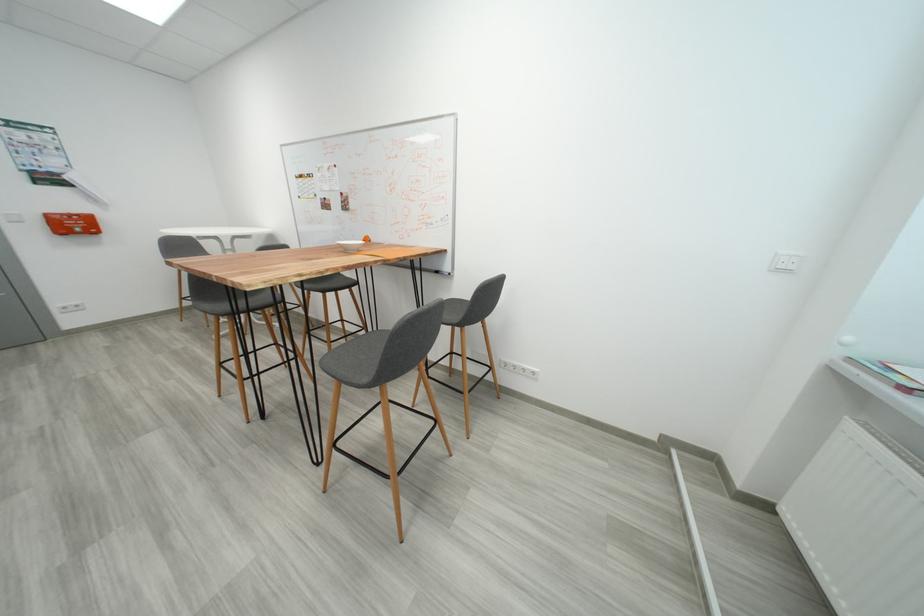
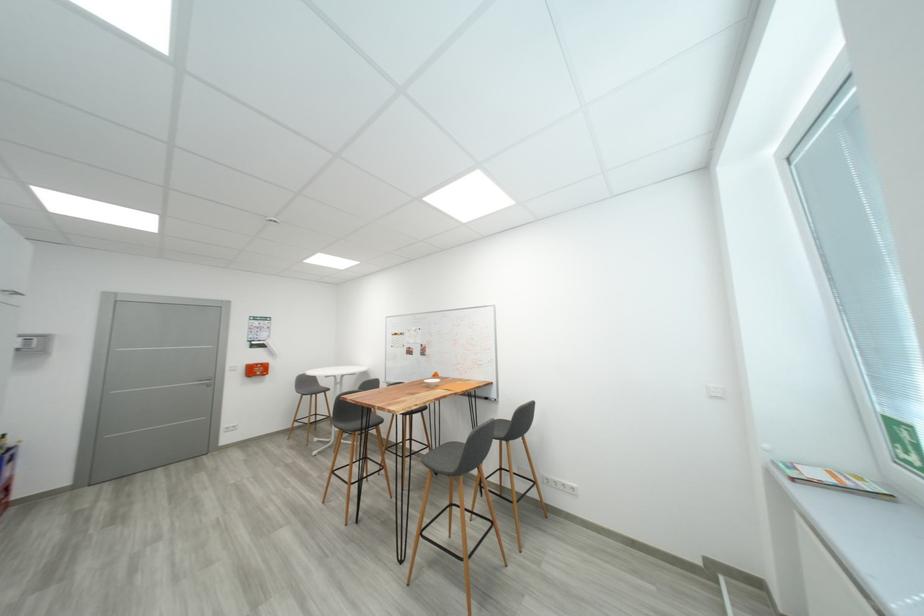
Question: In a continuous first-person perspective shot, in which direction is the camera moving?

Choices:
 (A) Left
 (B) Right
 (C) Forward
 (D) Backward

Answer: (D)